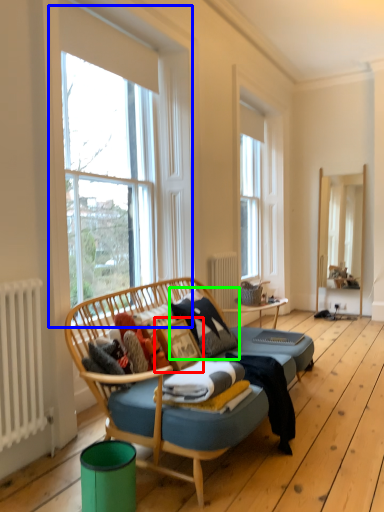
Question: Estimate the real-world distances between objects in this image. Which object is closer to picture frame (highlighted by a red box), window (highlighted by a blue box) or pillow (highlighted by a green box)?

Choices:
 (A) window
 (B) pillow

Answer: (B)